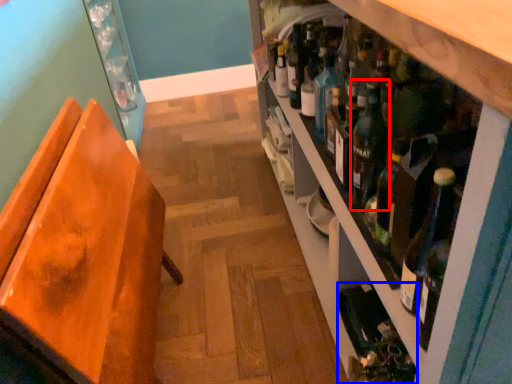
Question: Among these objects, which one is nearest to the camera, wine (highlighted by a red box) or wine bottle (highlighted by a blue box)?

Choices:
 (A) wine
 (B) wine bottle

Answer: (A)